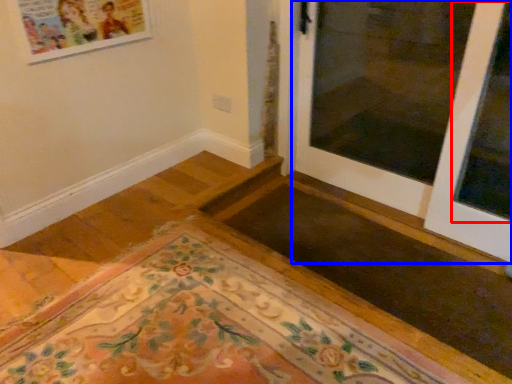
Question: Which of the following is the farthest to the observer, window (highlighted by a red box) or door (highlighted by a blue box)?

Choices:
 (A) window
 (B) door

Answer: (A)